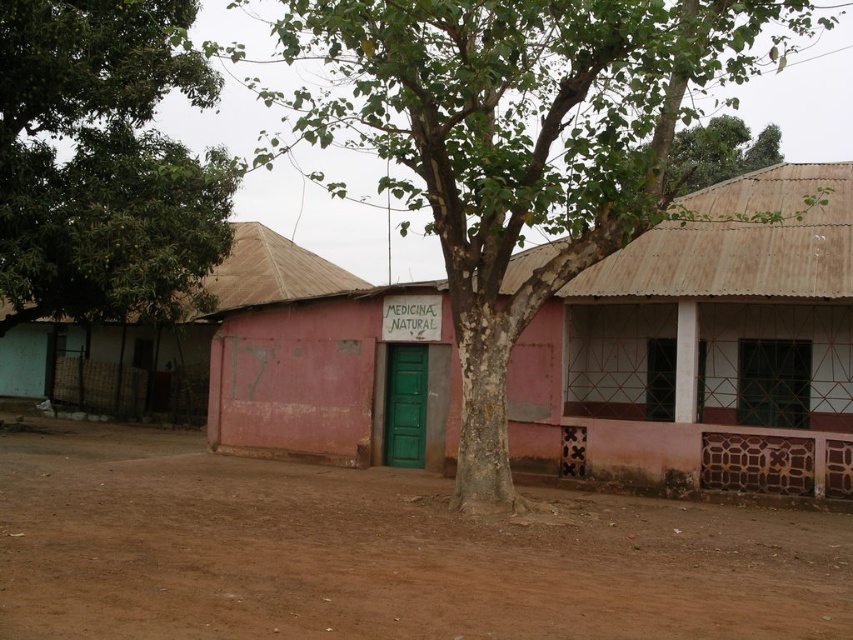
You are a visitor approaching the MEDICINA NATURAL clinic and need to park your car. The green bark tree at center is blocking the view of the clinic. Can you determine if the brown dirt field at lower center is a suitable parking spot based on their height relationship?

The brown dirt field at lower center is not as tall as the green bark tree at center, so the dirt field is lower in height. Since the tree is blocking the view, parking on the lower dirt field might be suitable as it won

You are standing in front of the MEDICINA NATURAL building and want to walk towards the green bark tree at center. Which direction should you move to avoid stepping on the brown dirt field at lower center?

The brown dirt field at lower center is closer to you than the green bark tree at center. To avoid stepping on the brown dirt field at lower center, you should move towards the green bark tree at center from a path that goes around the brown dirt field at lower center, as the tree is further away and you can navigate around the closer dirt field.

You are a delivery person trying to reach the MEDICINA NATURAL clinic. There are two trees in front of it. One is a green bark tree at center and the other is a green leafy tree at center. Which tree should you move around to get a clearer view of the clinic?

The green bark tree at center might be wider than the green leafy tree at center, so moving around the narrower green leafy tree at center would provide a clearer view of the clinic.